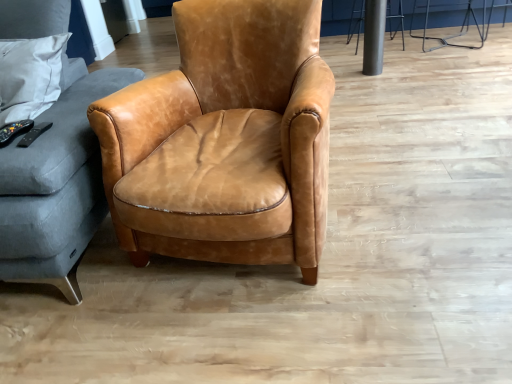
Question: Relative to cognac leather armchair at center, is metallic silver bar stool at upper right, the first bar stool when ordered from left to right, in front or behind?

Choices:
 (A) behind
 (B) front

Answer: (A)

Question: From a real-world perspective, is metallic silver bar stool at upper right, acting as the 2th bar stool starting from the right, positioned above or below cognac leather armchair at center?

Choices:
 (A) below
 (B) above

Answer: (A)

Question: Which object is the closest to the cognac leather armchair at center?

Choices:
 (A) metallic silver bar stool at upper right, the first bar stool when ordered from left to right
 (B) metallic silver bar stool at upper right, which is counted as the first bar stool, starting from the right
 (C) matte gray fabric studio couch at left

Answer: (C)

Question: Which is farther from the metallic silver bar stool at upper right, which is counted as the 2th bar stool, starting from the left?

Choices:
 (A) matte gray fabric studio couch at left
 (B) cognac leather armchair at center
 (C) metallic silver bar stool at upper right, acting as the 2th bar stool starting from the right

Answer: (A)